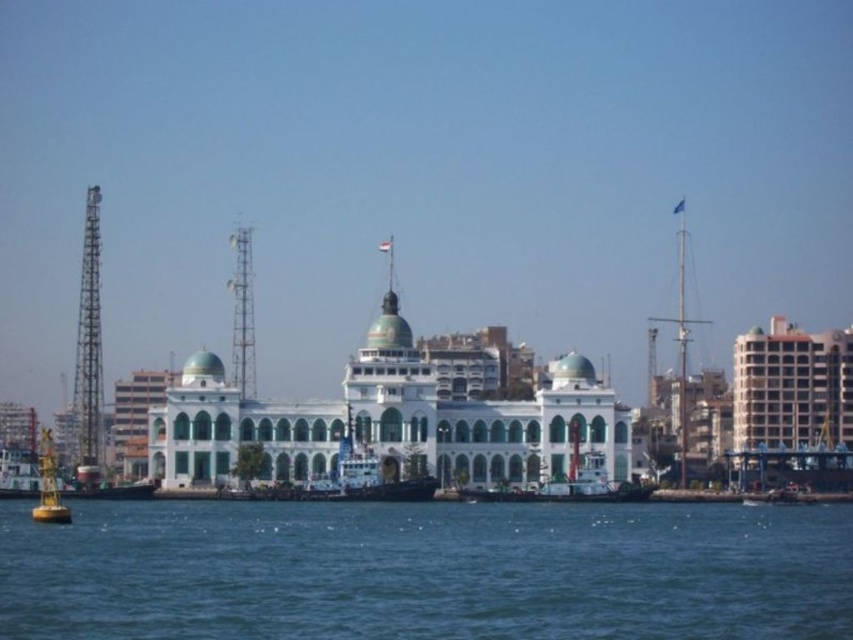
Question: Which object is closer to the camera taking this photo?

Choices:
 (A) white glossy boat at center
 (B) blue water at lower center

Answer: (B)

Question: Which point appears farthest from the camera in this image?

Choices:
 (A) (537, 500)
 (B) (225, 428)

Answer: (B)

Question: Is blue water at lower center smaller than white glossy boat at center?

Choices:
 (A) yes
 (B) no

Answer: (B)

Question: Based on their relative distances, which object is nearer to the white glossy boat at center?

Choices:
 (A) blue water at lower center
 (B) white matte tugboat at center

Answer: (B)

Question: In this image, where is white glossy boat at center located relative to white matte tugboat at center?

Choices:
 (A) right
 (B) left

Answer: (B)

Question: From the image, what is the correct spatial relationship of white glossy boat at center in relation to white matte tugboat at center?

Choices:
 (A) below
 (B) above

Answer: (B)